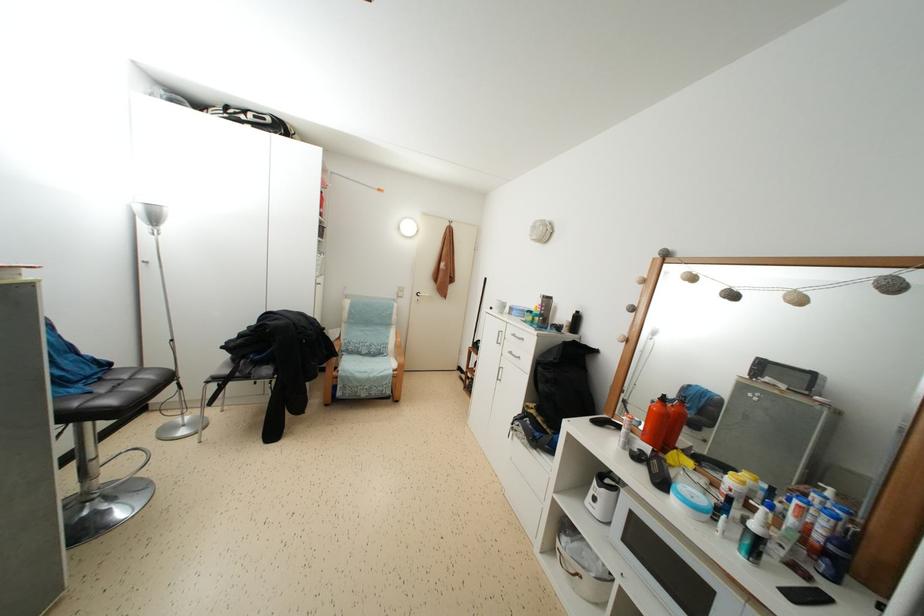
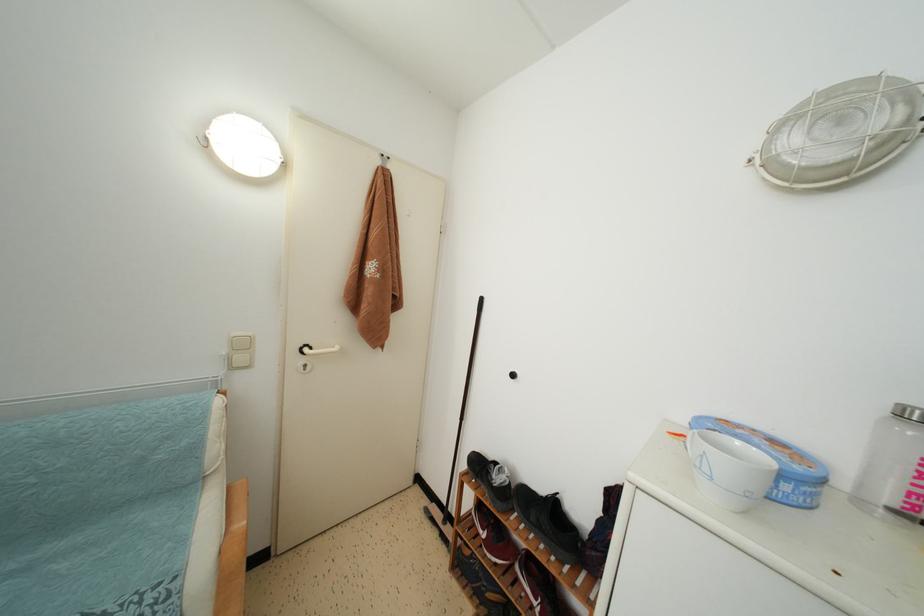
Question: Which direction would the cameraman need to move to produce the second image? Reply with the corresponding letter.

Choices:
 (A) Left
 (B) Right
 (C) Forward
 (D) Backward

Answer: (C)